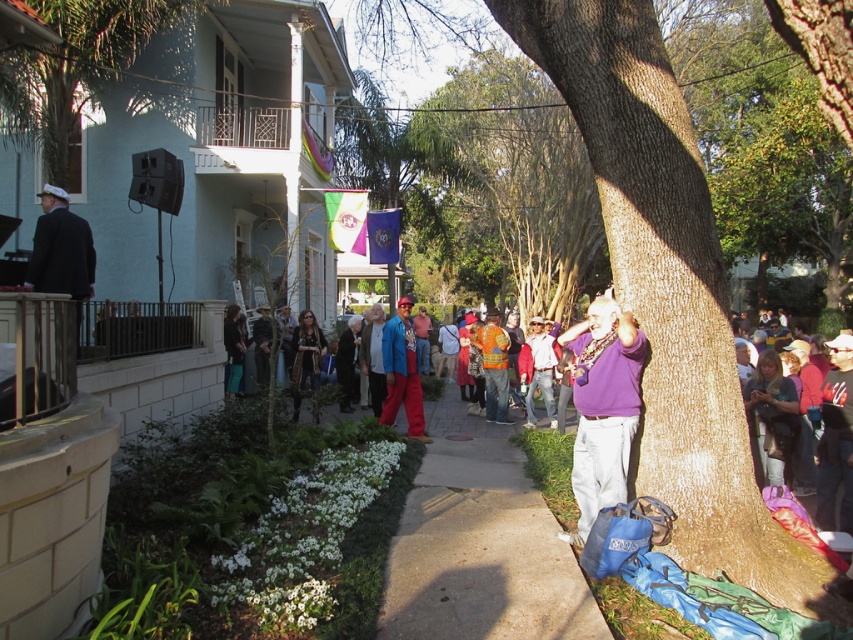
You are a photographer standing at the edge of the sidewalk near the tree trunk. You want to take a photo that includes both the matte black suit at left and the shiny blue jacket at center. Given that your camera has a maximum focus range of 5 meters, will you be able to capture both subjects in focus without moving your position?

The distance between the matte black suit at left and the shiny blue jacket at center is 5.25 meters. Since your camera can only focus up to 5 meters, you won

You are organizing a parade route and need to ensure that the participants can walk side by side. The participants include a person wearing a matte black suit at left and a person wearing a shiny blue jacket at center. Based on the scene, can both participants walk side by side without overlapping?

The matte black suit at left might be wider than shiny blue jacket at center, so there might not be enough space for them to walk side by side without overlapping.